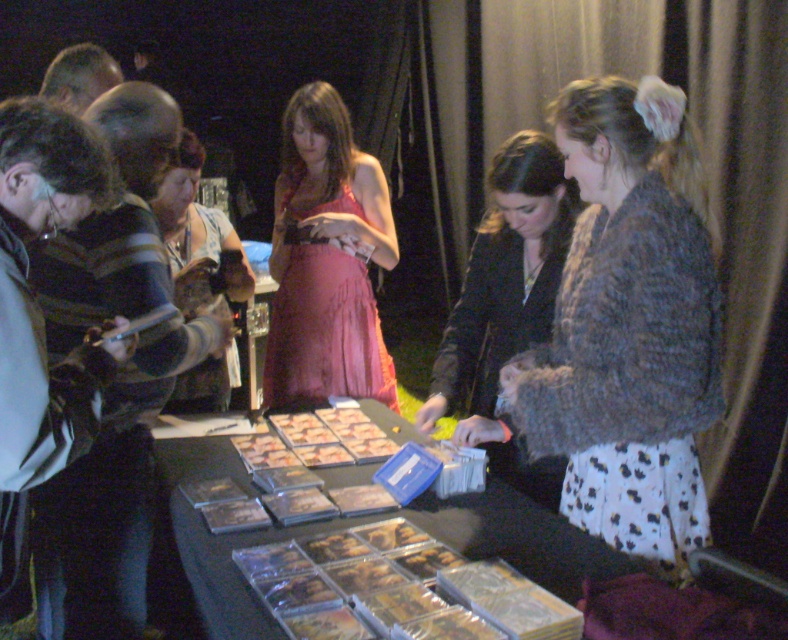
You are attending a signing event and see both the matte brown purse at center and the golden brown pastry at center on the table. Which object is closer to you?

The matte brown purse at center is closer to you because the golden brown pastry at center is positioned behind it.

You are attending a signing event and notice a fuzzy brown jacket at right. Where exactly is the fuzzy brown jacket located in the scene?

The fuzzy brown jacket at right is located at point (627,324) in the scene.

You are a guest at the signing event and want to grab the golden crispy chicken at center without touching the fuzzy brown jacket at right. Is this possible?

The fuzzy brown jacket at right is positioned on the right side of golden crispy chicken at center, so you can reach the golden crispy chicken at center from the left side without touching the jacket.